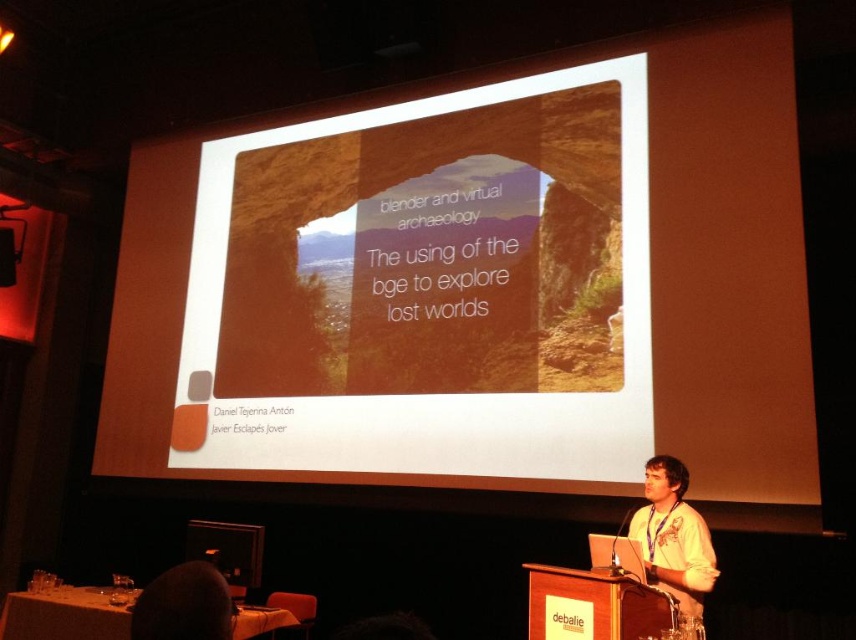
You are attending a presentation and notice two features in the scene. One is the white shirt at center and the other is the dark hair at lower left. Which of these two is closer to you as the viewer?

The white shirt at center is closer to the viewer than the dark hair at lower left because it is positioned further to the viewer in the scene.

You are an attendee at the presentation. You notice the speaker is wearing a white shirt at center and there is a matte orange slide at center. Which object is positioned to the right side from your perspective?

The white shirt at center is positioned to the right of the matte orange slide at center because the matte orange slide at center is to the left of the white shirt at center.